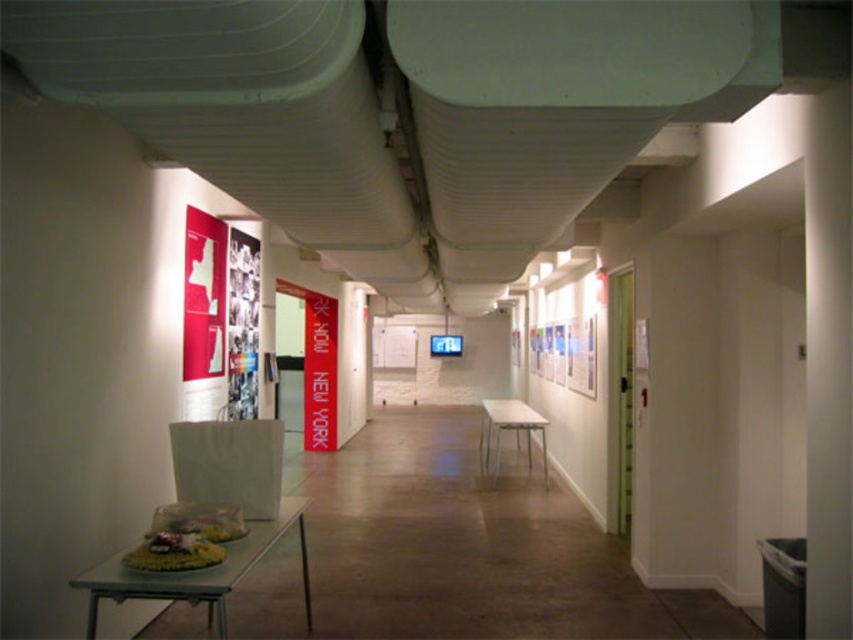
You are a delivery person entering the hallway and need to place a heavy box on the floor. You see the white plastic table at lower left and the white glossy table at center. Which table is closer to the floor where you can place the box?

The white plastic table at lower left is positioned under the white glossy table at center, so the white plastic table at lower left is closer to the floor. You can place the box there.

You are navigating through the hallway and need to reach a specific location. From your current position, which point should you move towards first, point A at coordinates point A is point (300, 536) or point B at coordinates point B is point (514, 426)?

You should move towards point A at coordinates point A is point (300, 536) first because it is in front of point B at coordinates point B is point (514, 426), meaning it is closer to your current position.

You are moving a large potted plant that is 1.2 meters wide. You need to place it in the hallway shown. Can the white plastic table at lower left and the white glossy table at center both accommodate the plant? Explain based on their sizes.

The white plastic table at lower left is larger in size than the white glossy table at center. The white plastic table at lower left may be able to accommodate the 1.2 meter wide plant, but the white glossy table at center might be too small since it is smaller than the plastic table. Check both tables to confirm.